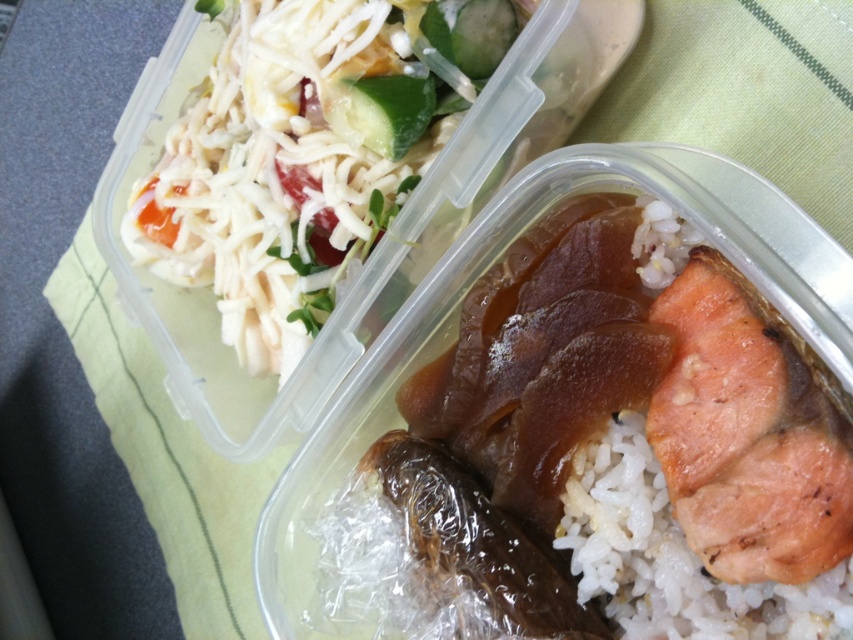
Question: Is white shredded cheese at upper left above white matte rice at center?

Choices:
 (A) no
 (B) yes

Answer: (B)

Question: Which of the following is the closest to the observer?

Choices:
 (A) white shredded cheese at upper left
 (B) white matte rice at lower right

Answer: (B)

Question: Does white shredded cheese at upper left appear on the left side of white matte rice at center?

Choices:
 (A) yes
 (B) no

Answer: (A)

Question: Which object is positioned farthest from the white matte rice at center?

Choices:
 (A) white shredded cheese at upper left
 (B) green crisp cucumber at upper center

Answer: (A)

Question: Considering the real-world distances, which object is farthest from the white matte rice at center?

Choices:
 (A) white matte rice at lower right
 (B) white shredded cheese at upper left
 (C) green crisp cucumber at upper center

Answer: (B)

Question: Is the position of white shredded cheese at upper left more distant than that of pinkish-brown flaky salmon at right?

Choices:
 (A) yes
 (B) no

Answer: (A)